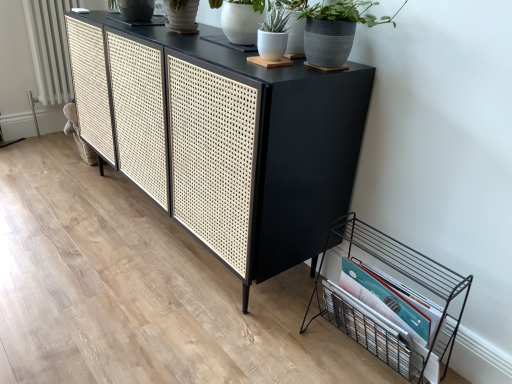
Question: Can you confirm if black wire magazine rack at lower right is shorter than white textured radiator at left?

Choices:
 (A) no
 (B) yes

Answer: (B)

Question: Is black wire magazine rack at lower right bigger than white textured radiator at left?

Choices:
 (A) yes
 (B) no

Answer: (A)

Question: Is black wire magazine rack at lower right positioned with its back to white textured radiator at left?

Choices:
 (A) no
 (B) yes

Answer: (A)

Question: Can you see black wire magazine rack at lower right touching white textured radiator at left?

Choices:
 (A) no
 (B) yes

Answer: (A)

Question: Is black wire magazine rack at lower right completely or partially outside of white textured radiator at left?

Choices:
 (A) no
 (B) yes

Answer: (B)

Question: Is white matte pot at upper center, which is the second houseplant from right to left, to the left or to the right of black woven cane cabinet at center in the image?

Choices:
 (A) left
 (B) right

Answer: (B)

Question: From a real-world perspective, is white matte pot at upper center, which is the second houseplant from right to left, positioned above or below black woven cane cabinet at center?

Choices:
 (A) above
 (B) below

Answer: (A)

Question: Choose the correct answer: Is white matte pot at upper center, which is the second houseplant from right to left, inside black woven cane cabinet at center or outside it?

Choices:
 (A) inside
 (B) outside

Answer: (B)

Question: Looking at their shapes, would you say white matte pot at upper center, acting as the 1th houseplant starting from the left, is wider or thinner than black woven cane cabinet at center?

Choices:
 (A) thin
 (B) wide

Answer: (A)

Question: In terms of height, does black wire magazine rack at lower right look taller or shorter compared to gray matte pot at upper right, acting as the second houseplant starting from the left?

Choices:
 (A) tall
 (B) short

Answer: (A)

Question: Do you think black wire magazine rack at lower right is within gray matte pot at upper right, which is the 1th houseplant from right to left, or outside of it?

Choices:
 (A) outside
 (B) inside

Answer: (A)

Question: Looking at the image, does black wire magazine rack at lower right seem bigger or smaller compared to gray matte pot at upper right, which is the 1th houseplant from right to left?

Choices:
 (A) big
 (B) small

Answer: (A)

Question: In terms of width, does black wire magazine rack at lower right look wider or thinner when compared to gray matte pot at upper right, which is the 1th houseplant from right to left?

Choices:
 (A) wide
 (B) thin

Answer: (A)

Question: Looking at their shapes, would you say white textured radiator at left is wider or thinner than white ceramic pot at upper center?

Choices:
 (A) wide
 (B) thin

Answer: (B)

Question: From their relative heights in the image, would you say white textured radiator at left is taller or shorter than white ceramic pot at upper center?

Choices:
 (A) tall
 (B) short

Answer: (A)